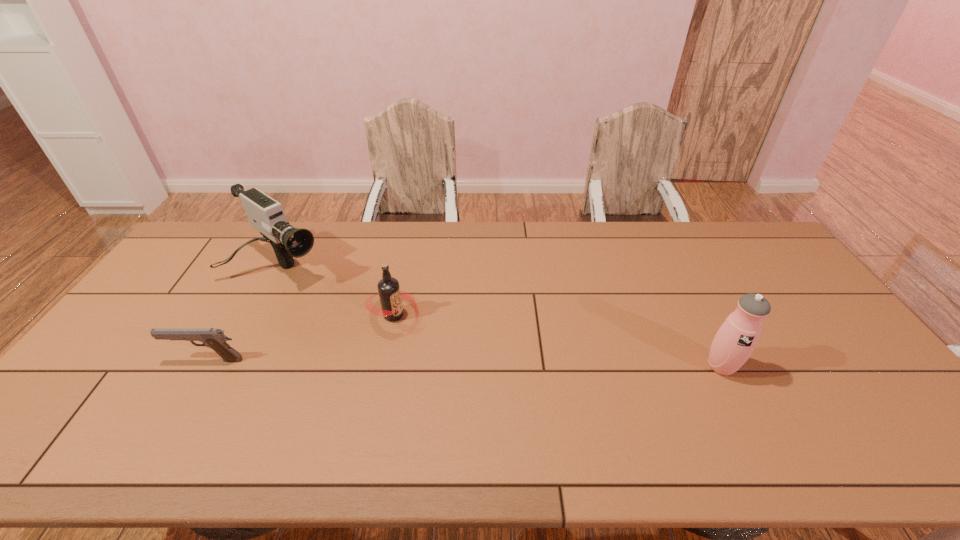
This screenshot has width=960, height=540. Find the location of `vacant region located on the label of the second farthest object`. vacant region located on the label of the second farthest object is located at coordinates (499, 386).

You are a GUI agent. You are given a task and a screenshot of the screen. Output one action in this format:
    pyautogui.click(x=<x>, y=<y>)
    Task: Click on the free point located on the label of the second farthest object
    
    Given the screenshot: What is the action you would take?
    pyautogui.click(x=502, y=388)

The image size is (960, 540). I want to click on vacant space located on the recording direction of the camcorder, so click(x=342, y=307).

This screenshot has width=960, height=540. Find the location of `free space located 0.400m on the recording direction of the camcorder`. free space located 0.400m on the recording direction of the camcorder is located at coordinates (395, 347).

I want to click on vacant region located on the recording direction of the camcorder, so click(x=392, y=345).

The height and width of the screenshot is (540, 960). In order to click on object that is at the far edge in this screenshot , I will do `click(265, 214)`.

Where is `free space at the far edge`? This screenshot has width=960, height=540. free space at the far edge is located at coordinates (348, 247).

This screenshot has width=960, height=540. In order to click on vacant space at the near edge of the desktop in this screenshot , I will do `click(584, 401)`.

Locate an element on the screen. free space at the right edge is located at coordinates (786, 316).

The height and width of the screenshot is (540, 960). In the image, there is a desktop. Find the location of `vacant space at the far left corner`. vacant space at the far left corner is located at coordinates (217, 258).